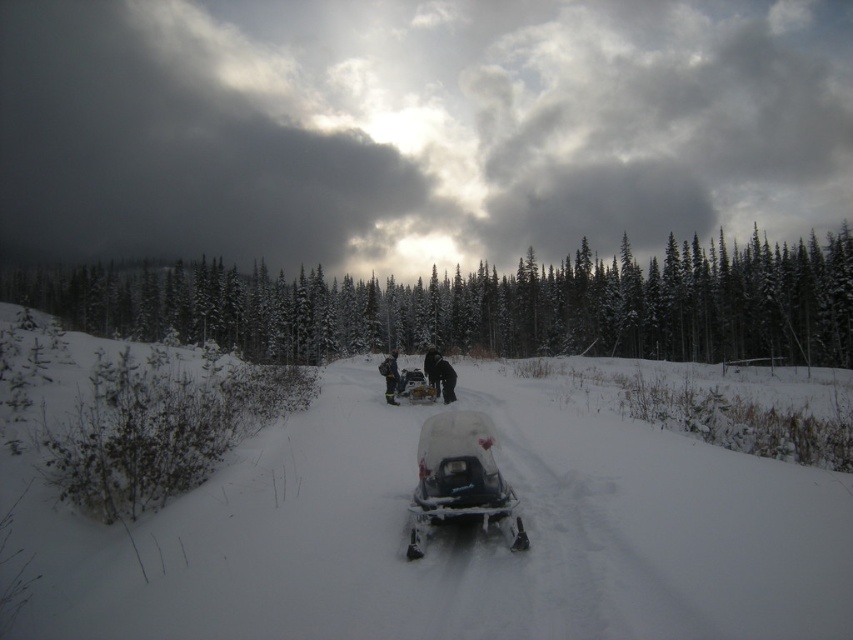
Looking at this image, is black fabric jacket at center wider than dark gray fabric backpack at center?

No.

Locate an element on the screen. The image size is (853, 640). black fabric jacket at center is located at coordinates (444, 378).

In the scene shown: Which of these two, white powdery snow at center or dark gray fabric backpack at center, stands shorter?

dark gray fabric backpack at center

Does white powdery snow at center have a smaller size compared to dark gray fabric backpack at center?

Incorrect, white powdery snow at center is not smaller in size than dark gray fabric backpack at center.

What do you see at coordinates (457, 536) in the screenshot? I see `white powdery snow at center` at bounding box center [457, 536].

The image size is (853, 640). What are the coordinates of `white powdery snow at center` in the screenshot? It's located at (457, 536).

Is point (482, 436) less distant than point (438, 378)?

Yes.

Is point (416, 516) positioned before point (433, 348)?

That is True.

Find the location of `white matte snowmobile at center`. white matte snowmobile at center is located at coordinates (460, 477).